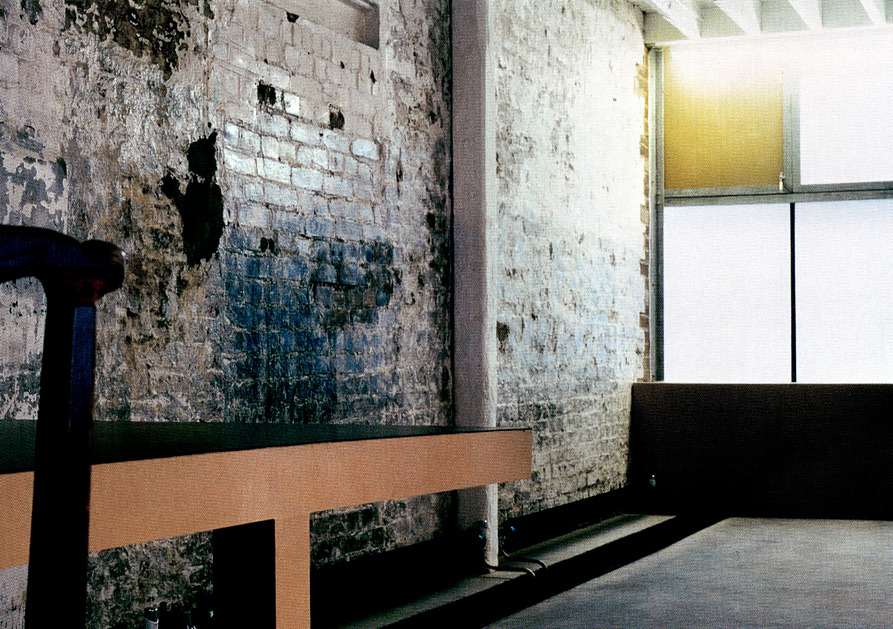
This screenshot has height=629, width=893. Find the location of `largest dark blemish on wall`. largest dark blemish on wall is located at coordinates (204, 209).